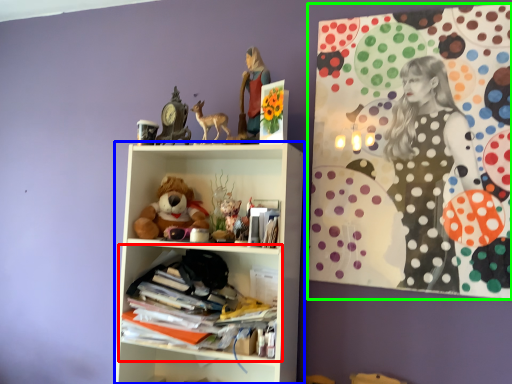
Question: Which is farther away from shelf (highlighted by a red box)? shelf (highlighted by a blue box) or bulletin board (highlighted by a green box)?

Choices:
 (A) shelf
 (B) bulletin board

Answer: (B)